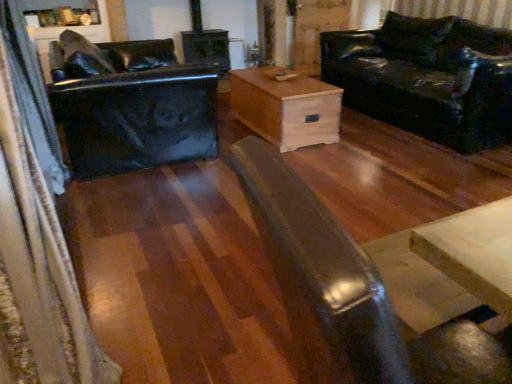
Question: Does point pos(181,130) appear closer or farther from the camera than point pos(384,317)?

Choices:
 (A) farther
 (B) closer

Answer: (A)

Question: Visually, is glossy black swivel chair at left positioned to the left or to the right of matte black coffee table at center?

Choices:
 (A) right
 (B) left

Answer: (B)

Question: Based on their relative distances, which object is nearer to the velvet dark blue curtain at left?

Choices:
 (A) matte black coffee table at center
 (B) shiny black leather couch at right
 (C) natural wood chest at center
 (D) glossy black swivel chair at left

Answer: (D)

Question: Considering the real-world distances, which object is closest to the glossy black swivel chair at left?

Choices:
 (A) shiny black leather couch at right
 (B) velvet dark blue curtain at left
 (C) natural wood chest at center
 (D) matte black coffee table at center

Answer: (B)